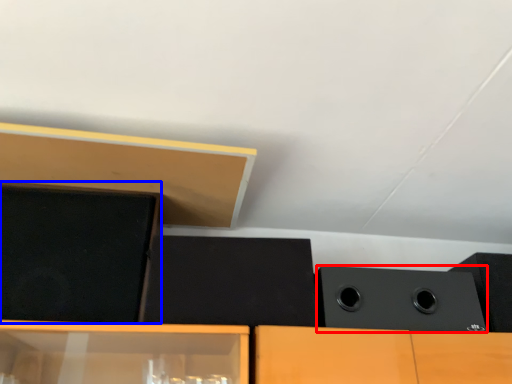
Question: Which point is closer to the camera, speaker (highlighted by a red box) or speaker (highlighted by a blue box)?

Choices:
 (A) speaker
 (B) speaker

Answer: (B)